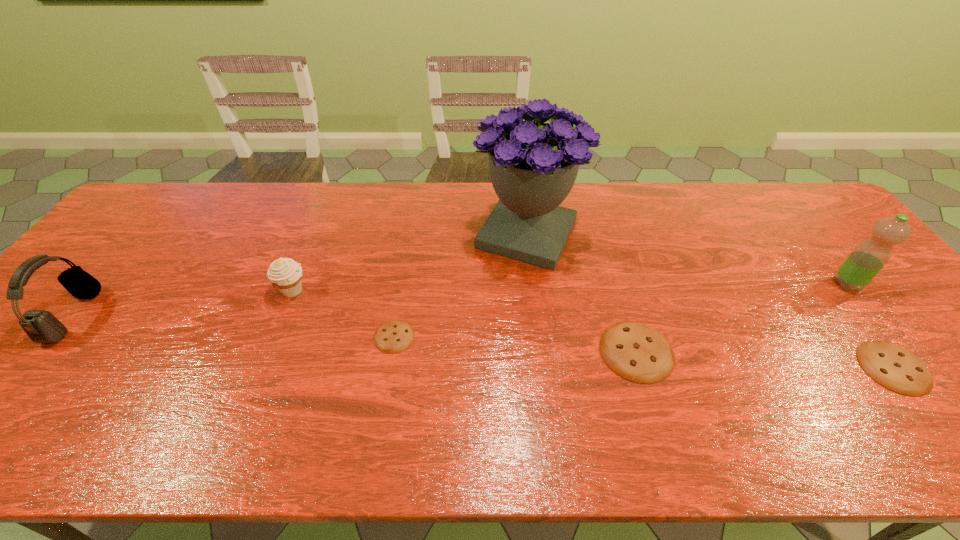
Where is `object that is the fifth closest one to the fourth shortest object`? This screenshot has height=540, width=960. object that is the fifth closest one to the fourth shortest object is located at coordinates (895, 368).

Select which object appears as the third closest to the second cookie from left to right. Please provide its 2D coordinates. Your answer should be formatted as a tuple, i.e. [(x, y)], where the tuple contains the x and y coordinates of a point satisfying the conditions above.

[(395, 336)]

You are a GUI agent. You are given a task and a screenshot of the screen. Output one action in this format:
    pyautogui.click(x=<x>, y=<y>)
    Task: Click on the cookie that can be found as the second closest to the second cookie from left to right
    Image resolution: width=960 pixels, height=540 pixels.
    Given the screenshot: What is the action you would take?
    pyautogui.click(x=395, y=336)

Identify the location of cookie that is the third closest to the bouquet. The image size is (960, 540). point(895,368).

Where is `vacant point that satisfies the following two spatial constraints: 1. on the back side of the water bottle; 2. on the right side of the second tallest cookie`? vacant point that satisfies the following two spatial constraints: 1. on the back side of the water bottle; 2. on the right side of the second tallest cookie is located at coordinates (830, 285).

What are the coordinates of `vacant space that satisfies the following two spatial constraints: 1. on the back side of the tallest object; 2. on the right side of the sixth object from right to left` in the screenshot? It's located at (315, 234).

Where is `vacant space that satisfies the following two spatial constraints: 1. on the headband of the second cookie from right to left; 2. on the right side of the third tallest object`? vacant space that satisfies the following two spatial constraints: 1. on the headband of the second cookie from right to left; 2. on the right side of the third tallest object is located at coordinates (43, 352).

Identify the location of free spot that satisfies the following two spatial constraints: 1. on the headband of the rightmost cookie; 2. on the left side of the fifth shortest object. (31, 367).

Locate an element on the screen. This screenshot has width=960, height=540. vacant region that satisfies the following two spatial constraints: 1. on the headband of the headset; 2. on the left side of the shortest cookie is located at coordinates (56, 336).

This screenshot has width=960, height=540. What are the coordinates of `free space in the image that satisfies the following two spatial constraints: 1. on the headband of the leftmost cookie; 2. on the left side of the headset` in the screenshot? It's located at pos(56,336).